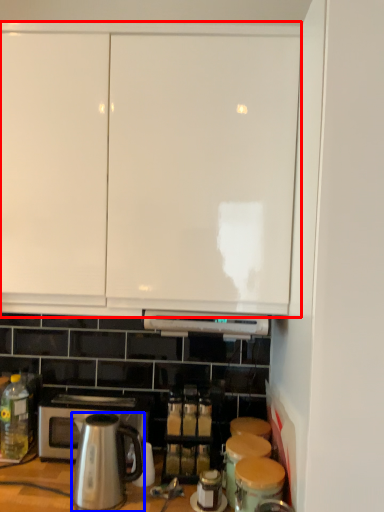
Question: Which object appears closest to the camera in this image, cabinetry (highlighted by a red box) or kitchen appliance (highlighted by a blue box)?

Choices:
 (A) cabinetry
 (B) kitchen appliance

Answer: (A)